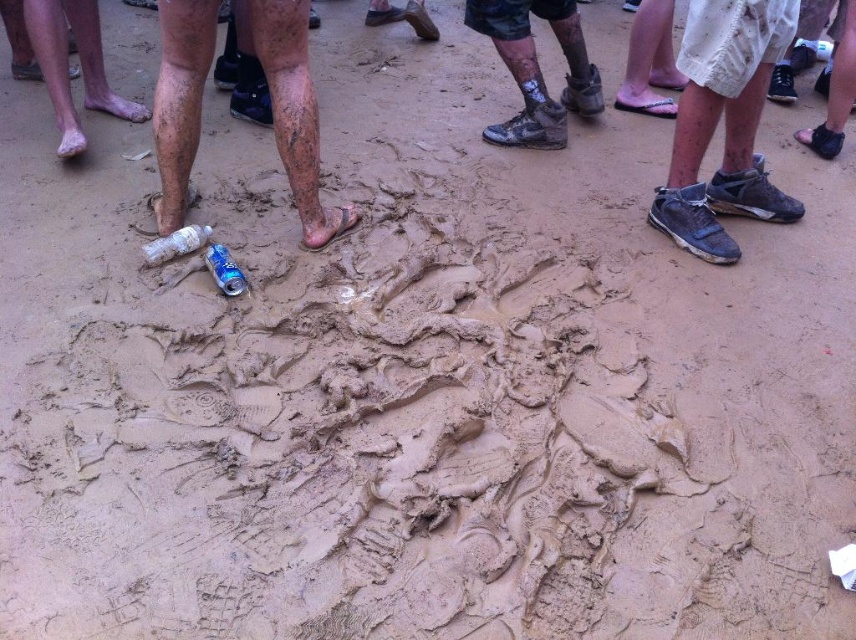
You are a photographer setting up a shoot on this muddy terrain. You need to place a new object between the dirty gray sneakers at lower right and the translucent plastic bottle at lower left. Is this possible given their positions?

The dirty gray sneakers at lower right is located above the translucent plastic bottle at lower left, so placing an object between them would require positioning it below the sneakers and above the bottle. Since they are vertically aligned, there is space between them to place the new object.

You are a photographer setting up a tripod in this muddy scene. You need to place your tripod between the translucent plastic bottle at lower left and the blue metallic can at center. Which object should you position the tripod closer to if you want it to be on the shorter side of the two objects?

The translucent plastic bottle at lower left is not as tall as the blue metallic can at center, so you should position the tripod closer to the translucent plastic bottle at lower left to be on the shorter side.

You are a photographer setting up a shot of the muddy terrain. You have to decide whether to focus on the dirty gray sneakers at lower right or the translucent plastic bottle at lower left based on their height. Which object should you choose if you want to highlight something taller?

The dirty gray sneakers at lower right is much taller than the translucent plastic bottle at lower left, so you should focus on the dirty gray sneakers at lower right to highlight the taller object.